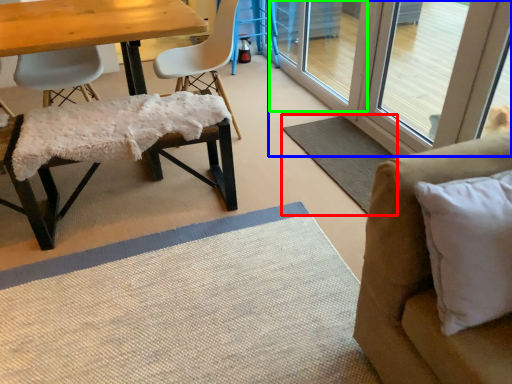
Question: Considering the real-world distances, which object is closest to mat (highlighted by a red box)? screen door (highlighted by a blue box) or screen door (highlighted by a green box).

Choices:
 (A) screen door
 (B) screen door

Answer: (A)